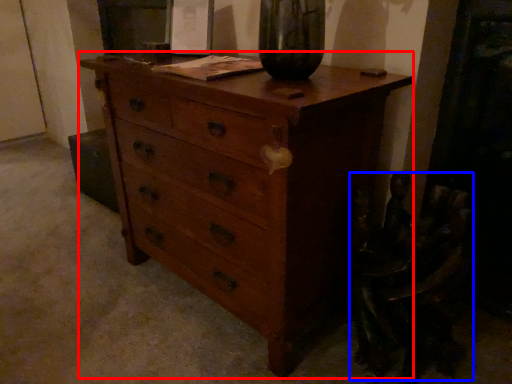
Question: Which point is further to the camera, chest of drawers (highlighted by a red box) or swivel chair (highlighted by a blue box)?

Choices:
 (A) chest of drawers
 (B) swivel chair

Answer: (B)